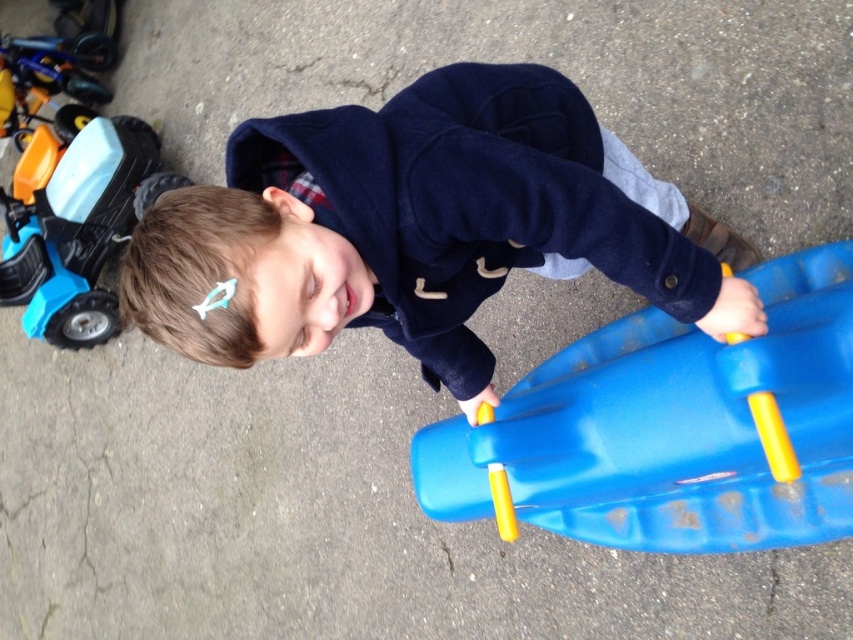
Question: Does matte blue jacket at center have a lesser width compared to blue plastic sled at center?

Choices:
 (A) yes
 (B) no

Answer: (B)

Question: Which point is farther to the camera?

Choices:
 (A) (99, 116)
 (B) (421, 189)
 (C) (599, 433)

Answer: (A)

Question: Does blue plastic sled at center appear on the right side of blue plastic toy car at left?

Choices:
 (A) no
 (B) yes

Answer: (B)

Question: Which of the following is the closest to the observer?

Choices:
 (A) blue plastic toy car at left
 (B) blue plastic sled at center
 (C) matte blue jacket at center

Answer: (B)

Question: Among these points, which one is farthest from the camera?

Choices:
 (A) (502, 460)
 (B) (642, 218)

Answer: (A)

Question: Can you confirm if matte blue jacket at center is thinner than blue plastic sled at center?

Choices:
 (A) no
 (B) yes

Answer: (A)